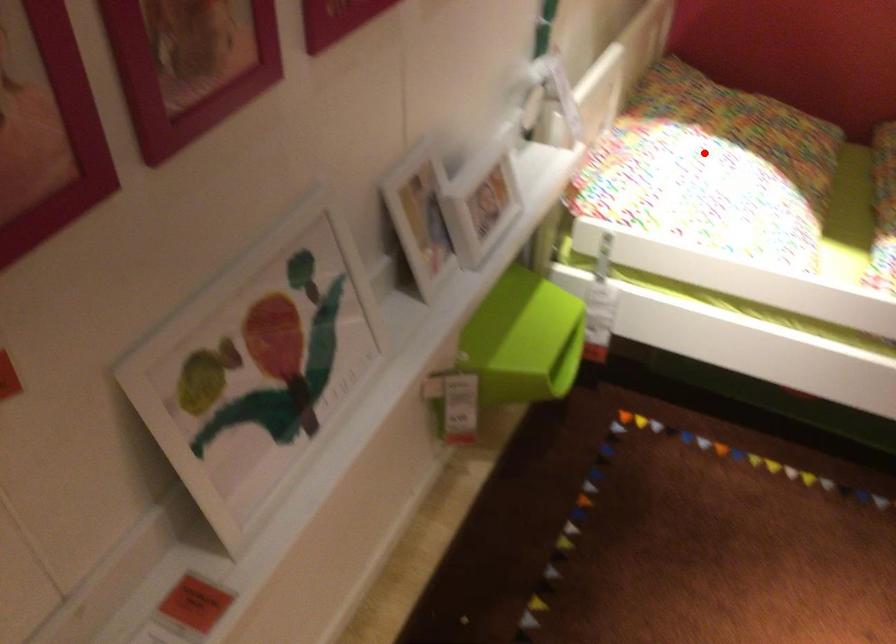
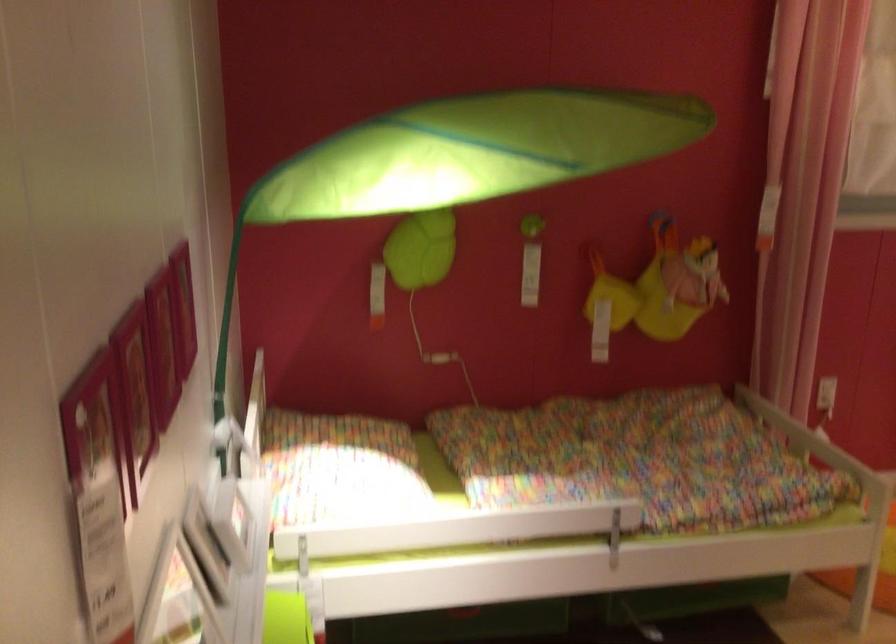
The point at the highlighted location is marked in the first image. Where is the corresponding point in the second image?

(339, 468)